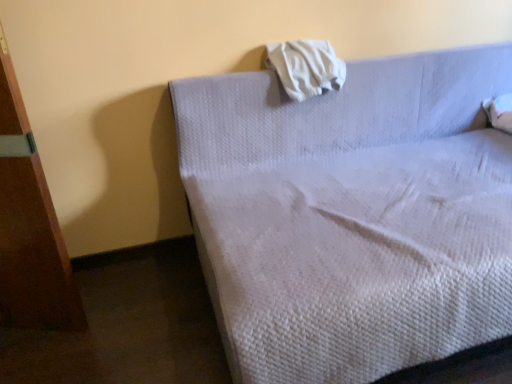
Question: Would you say white soft cloth at upper center is to the left or to the right of white quilted fabric bed at upper center in the picture?

Choices:
 (A) right
 (B) left

Answer: (B)

Question: From a real-world perspective, is white soft cloth at upper center physically located above or below white quilted fabric bed at upper center?

Choices:
 (A) below
 (B) above

Answer: (B)

Question: In terms of size, does white soft cloth at upper center appear bigger or smaller than white quilted fabric bed at upper center?

Choices:
 (A) small
 (B) big

Answer: (A)

Question: From the image's perspective, is white quilted fabric bed at upper center above or below white soft cloth at upper center?

Choices:
 (A) below
 (B) above

Answer: (A)

Question: Considering the positions of white quilted fabric bed at upper center and white soft cloth at upper center in the image, is white quilted fabric bed at upper center wider or thinner than white soft cloth at upper center?

Choices:
 (A) thin
 (B) wide

Answer: (B)

Question: Considering the positions of white quilted fabric bed at upper center and white soft cloth at upper center in the image, is white quilted fabric bed at upper center bigger or smaller than white soft cloth at upper center?

Choices:
 (A) small
 (B) big

Answer: (B)

Question: Considering their positions, is white quilted fabric bed at upper center located in front of or behind white soft cloth at upper center?

Choices:
 (A) front
 (B) behind

Answer: (A)